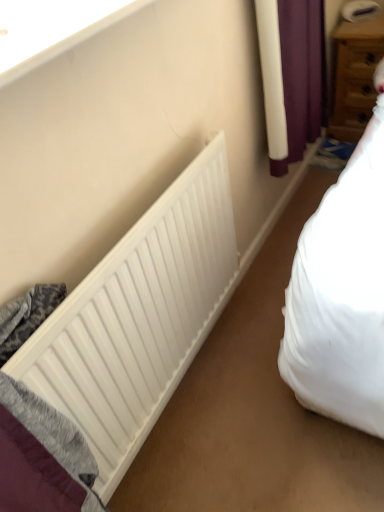
Question: Considering their positions, is white smooth window sill at upper left located in front of or behind white matte radiator at lower left?

Choices:
 (A) front
 (B) behind

Answer: (A)

Question: Is white smooth window sill at upper left to the left or to the right of white matte radiator at lower left in the image?

Choices:
 (A) left
 (B) right

Answer: (A)

Question: Which object is positioned farthest from the white matte radiator at lower left?

Choices:
 (A) wooden drawer at upper right
 (B) white smooth window sill at upper left

Answer: (A)

Question: Estimate the real-world distances between objects in this image. Which object is farther from the wooden drawer at upper right?

Choices:
 (A) white smooth window sill at upper left
 (B) white matte radiator at lower left

Answer: (A)